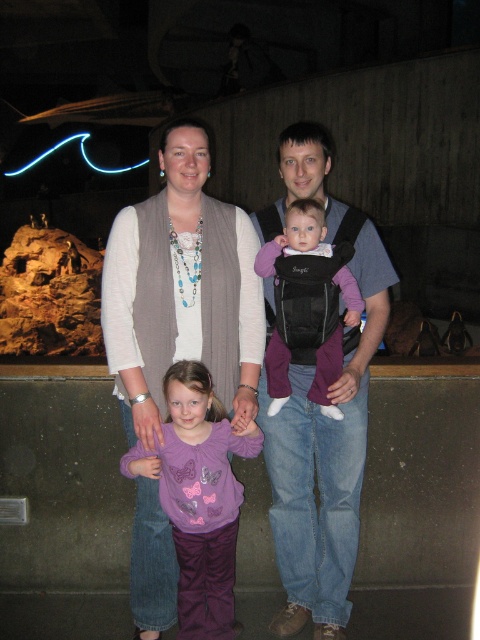
Can you confirm if matte gray vest at center is thinner than denim jeans at center?

In fact, matte gray vest at center might be wider than denim jeans at center.

Is point (137, 532) positioned behind point (370, 262)?

That is False.

Between point (141, 486) and point (286, 435), which one is positioned behind?

Point (286, 435)

Locate an element on the screen. Image resolution: width=480 pixels, height=640 pixels. matte gray vest at center is located at coordinates (181, 291).

From the picture: Which is above, denim jeans at center or purple satin shirt at lower center?

denim jeans at center is higher up.

Image resolution: width=480 pixels, height=640 pixels. Describe the element at coordinates (321, 413) in the screenshot. I see `denim jeans at center` at that location.

Is point (327, 536) more distant than point (175, 422)?

Yes, point (327, 536) is farther from viewer.

Locate an element on the screen. The image size is (480, 640). denim jeans at center is located at coordinates (321, 413).

Does purple satin shirt at lower center have a smaller size compared to purple fleece carrier at center?

Incorrect, purple satin shirt at lower center is not smaller in size than purple fleece carrier at center.

Who is lower down, purple satin shirt at lower center or purple fleece carrier at center?

purple satin shirt at lower center is lower down.

Where is `purple satin shirt at lower center`? purple satin shirt at lower center is located at coordinates (199, 497).

Identify the location of purple satin shirt at lower center. The width and height of the screenshot is (480, 640). (199, 497).